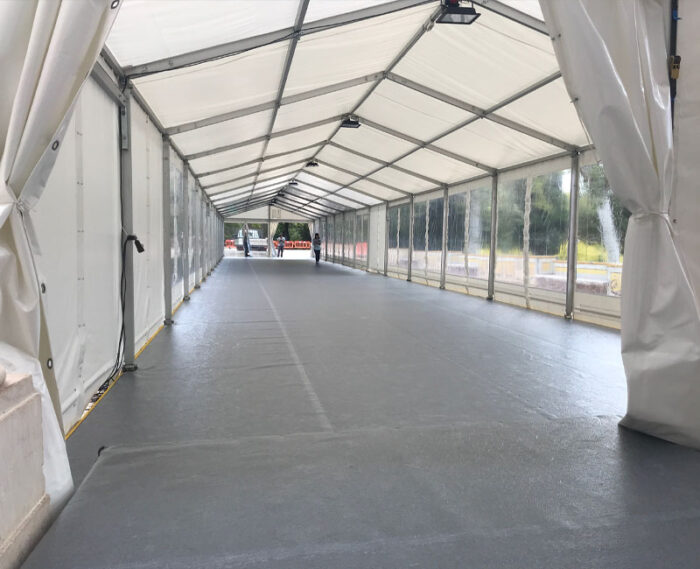
Locate an element on the screen. extension cord is located at coordinates (119, 338).